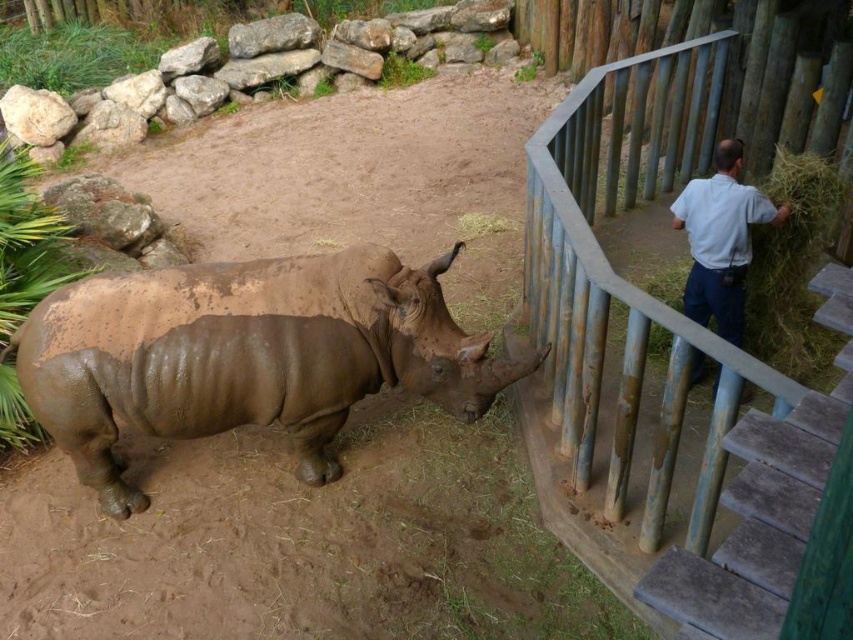
You are a zoo visitor who wants to climb the rusty metal stairs at right to get a better view of the rhinoceros. However, you notice the white shirt at upper right belongs to a zookeeper. Can you safely climb the stairs without blocking the zookeeper?

The rusty metal stairs at right is wider than the white shirt at upper right, so you can climb the stairs without blocking the zookeeper as there is enough space between them.

From the picture: You are a zoo visitor who wants to take a photo of the rhinoceros. You are standing on the rusty metal stairs at right. Can you see the entire rustic wooden railing at right in your view without moving your position?

The rustic wooden railing at right is much taller than the rusty metal stairs at right, so when standing on the stairs, part of the railing may block your view of the rhinoceros or obscure the full railing in your photo.

You are a zookeeper needing to move from the rhinoceros enclosure to the visitor area. You are currently standing near the rustic wooden railing at right and the rusty metal stairs at right. Which path allows you to move sideways without turning around?

The rustic wooden railing at right has a larger width than the rusty metal stairs at right, so moving sideways through the rustic wooden railing at right would allow more space to move without turning around.